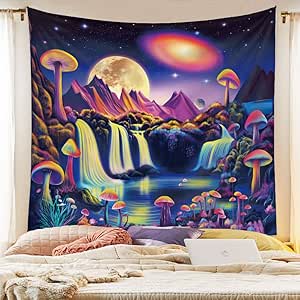
Find the location of a particular element. yellow pillow is located at coordinates (266, 240).